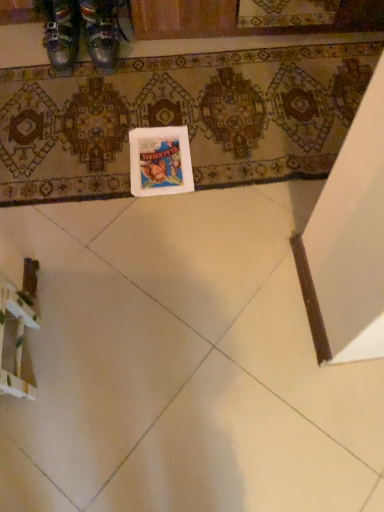
I want to click on free space in front of metallic leather shoes at upper left, the 1th footwear from the right, so click(104, 84).